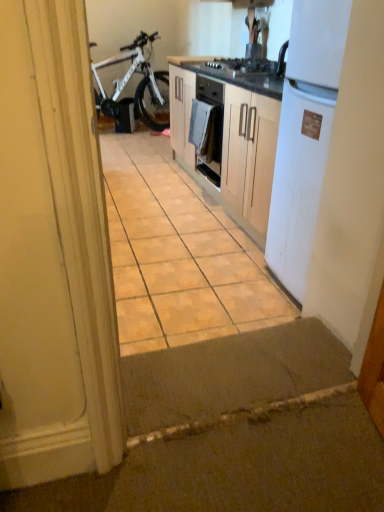
I want to click on white matte refrigerator at right, so click(x=304, y=135).

Where is `white matte refrigerator at right`? The image size is (384, 512). white matte refrigerator at right is located at coordinates (304, 135).

From the image's perspective, which one is positioned higher, white cloth at center or brown matte tile at center?

white cloth at center appears higher in the image.

Looking at this image, does white cloth at center come in front of brown matte tile at center?

That is False.

Considering the relative sizes of white cloth at center and brown matte tile at center in the image provided, is white cloth at center smaller than brown matte tile at center?

Correct, white cloth at center occupies less space than brown matte tile at center.

From a real-world perspective, is white matte bicycle at left below white cloth at center?

Incorrect, from a real-world perspective, white matte bicycle at left is higher than white cloth at center.

Does white matte bicycle at left have a larger size compared to white cloth at center?

Yes, white matte bicycle at left is bigger than white cloth at center.

Are white matte bicycle at left and white cloth at center making contact?

white matte bicycle at left and white cloth at center are clearly separated.

Does white matte bicycle at left have a lesser width compared to white cloth at center?

No, white matte bicycle at left is not thinner than white cloth at center.

Is brown matte tile at center thinner than white matte refrigerator at right?

In fact, brown matte tile at center might be wider than white matte refrigerator at right.

How different are the orientations of brown matte tile at center and white matte refrigerator at right in degrees?

92.1 degrees.

Which object is further away from the camera, brown matte tile at center or white matte refrigerator at right?

brown matte tile at center is further from the camera.

Looking at this image, which is closer, (x=129, y=327) or (x=324, y=122)?

The point (x=324, y=122) is in front.

Is white matte refrigerator at right oriented away from white matte bicycle at left?

No, white matte bicycle at left is not at the back of white matte refrigerator at right.

Can you confirm if white matte refrigerator at right is thinner than white matte bicycle at left?

Correct, the width of white matte refrigerator at right is less than that of white matte bicycle at left.

From the image's perspective, is white matte refrigerator at right on white matte bicycle at left?

Actually, white matte refrigerator at right appears below white matte bicycle at left in the image.

Is white matte refrigerator at right directly adjacent to white matte bicycle at left?

No, white matte refrigerator at right is not next to white matte bicycle at left.

Is white matte bicycle at left bigger than white matte refrigerator at right?

Yes, white matte bicycle at left is bigger than white matte refrigerator at right.

Considering the relative sizes of white matte bicycle at left and white matte refrigerator at right in the image provided, is white matte bicycle at left shorter than white matte refrigerator at right?

Indeed, white matte bicycle at left has a lesser height compared to white matte refrigerator at right.

Considering the positions of objects white matte bicycle at left and white matte refrigerator at right in the image provided, who is in front, white matte bicycle at left or white matte refrigerator at right?

white matte refrigerator at right.

From a real-world perspective, relative to white matte refrigerator at right, is white matte bicycle at left vertically above or below?

In terms of real-world spatial position, white matte bicycle at left is below white matte refrigerator at right.

Is white matte bicycle at left completely or partially outside of brown matte tile at center?

white matte bicycle at left lies outside brown matte tile at center's area.

Considering the sizes of white matte bicycle at left and brown matte tile at center in the image, is white matte bicycle at left taller or shorter than brown matte tile at center?

white matte bicycle at left is taller than brown matte tile at center.

Considering the points (152, 119) and (230, 334), which point is in front, point (152, 119) or point (230, 334)?

The point (230, 334) is closer to the camera.

Is the surface of white matte bicycle at left in direct contact with brown matte tile at center?

No, white matte bicycle at left is not beside brown matte tile at center.

Considering the sizes of brown matte tile at center and white matte bicycle at left in the image, is brown matte tile at center wider or thinner than white matte bicycle at left?

brown matte tile at center is wider than white matte bicycle at left.

From the image's perspective, would you say brown matte tile at center is shown under white matte bicycle at left?

Yes, from the image's perspective, brown matte tile at center is below white matte bicycle at left.

Is brown matte tile at center next to white matte bicycle at left?

No, brown matte tile at center is not touching white matte bicycle at left.

In order to click on ceramic tile in front of the white cloth at center in this screenshot , I will do `click(178, 254)`.

The width and height of the screenshot is (384, 512). Identify the location of bicycle above the white cloth at center (from a real-world perspective). (137, 86).

From the image, which object appears to be farther from white matte bicycle at left, white matte refrigerator at right or brown matte tile at center?

Among the two, white matte refrigerator at right is located further to white matte bicycle at left.

Based on their spatial positions, is white cloth at center or brown matte tile at center further from white matte bicycle at left?

white cloth at center is positioned further to the anchor white matte bicycle at left.

Which object lies nearer to the anchor point white matte bicycle at left, brown matte tile at center or white matte refrigerator at right?

brown matte tile at center is closer to white matte bicycle at left.

From the image, which object appears to be farther from white matte bicycle at left, white matte refrigerator at right or white cloth at center?

Among the two, white matte refrigerator at right is located further to white matte bicycle at left.

Considering their positions, is white matte bicycle at left positioned further to white cloth at center than brown matte tile at center?

white matte bicycle at left lies further to white cloth at center than the other object.

Which object lies nearer to the anchor point brown matte tile at center, white cloth at center or white matte bicycle at left?

white cloth at center.

Considering their positions, is white matte refrigerator at right positioned further to brown matte tile at center than white cloth at center?

Based on the image, white matte refrigerator at right appears to be further to brown matte tile at center.

Based on their spatial positions, is white matte bicycle at left or white cloth at center further from white matte refrigerator at right?

white matte bicycle at left is positioned further to the anchor white matte refrigerator at right.

This screenshot has width=384, height=512. In order to click on ceramic tile between white matte refrigerator at right and white matte bicycle at left along the z-axis in this screenshot , I will do `click(178, 254)`.

Locate an element on the screen. Image resolution: width=384 pixels, height=512 pixels. towel/napkin between white matte refrigerator at right and white matte bicycle at left in the front-back direction is located at coordinates (203, 129).

You are a GUI agent. You are given a task and a screenshot of the screen. Output one action in this format:
    pyautogui.click(x=<x>, y=<y>)
    Task: Click on the ceramic tile between white matte refrigerator at right and white cloth at center from front to back
    The width and height of the screenshot is (384, 512).
    Given the screenshot: What is the action you would take?
    pyautogui.click(x=178, y=254)

Find the location of a particular element. The height and width of the screenshot is (512, 384). towel/napkin located between brown matte tile at center and white matte bicycle at left in the depth direction is located at coordinates (203, 129).